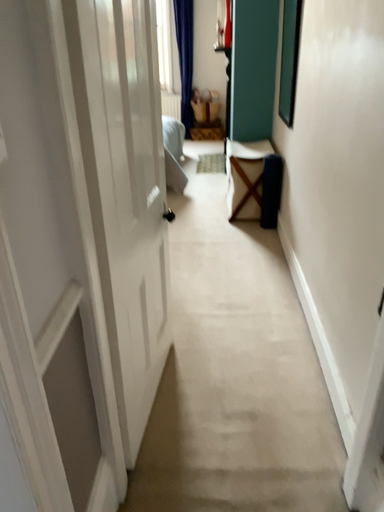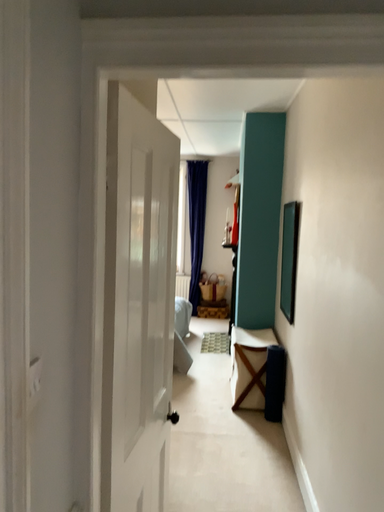
Question: Which way did the camera rotate in the video?

Choices:
 (A) rotated upward
 (B) rotated downward

Answer: (A)